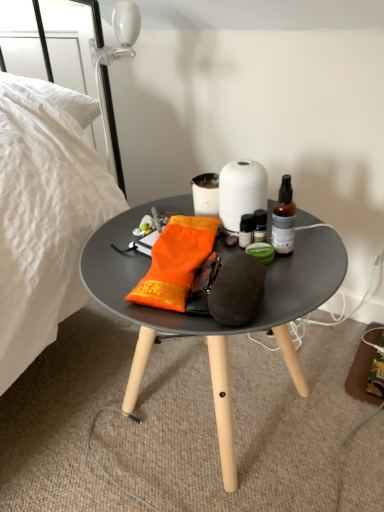
Question: Looking at their shapes, would you say matte gray coffee table at center is wider or thinner than brown glass bottle at center?

Choices:
 (A) wide
 (B) thin

Answer: (A)

Question: Which is correct: matte gray coffee table at center is inside brown glass bottle at center, or outside of it?

Choices:
 (A) inside
 (B) outside

Answer: (B)

Question: Which of these objects is positioned closest to the white matte vase at center?

Choices:
 (A) brown glass bottle at center
 (B) matte gray coffee table at center
 (C) orange fabric pouch at center

Answer: (A)

Question: Estimate the real-world distances between objects in this image. Which object is farther from the matte gray coffee table at center?

Choices:
 (A) white matte vase at center
 (B) brown glass bottle at center
 (C) orange fabric pouch at center

Answer: (A)